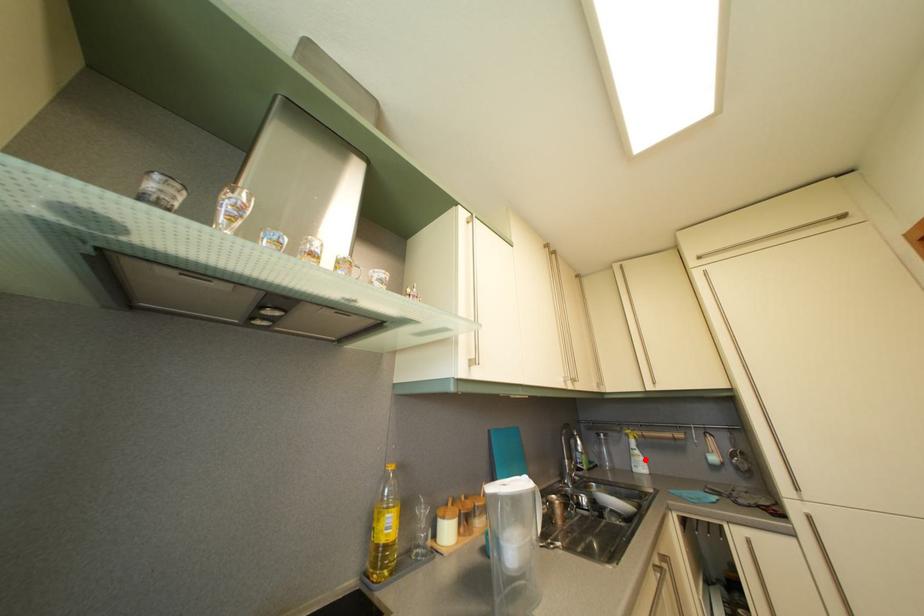
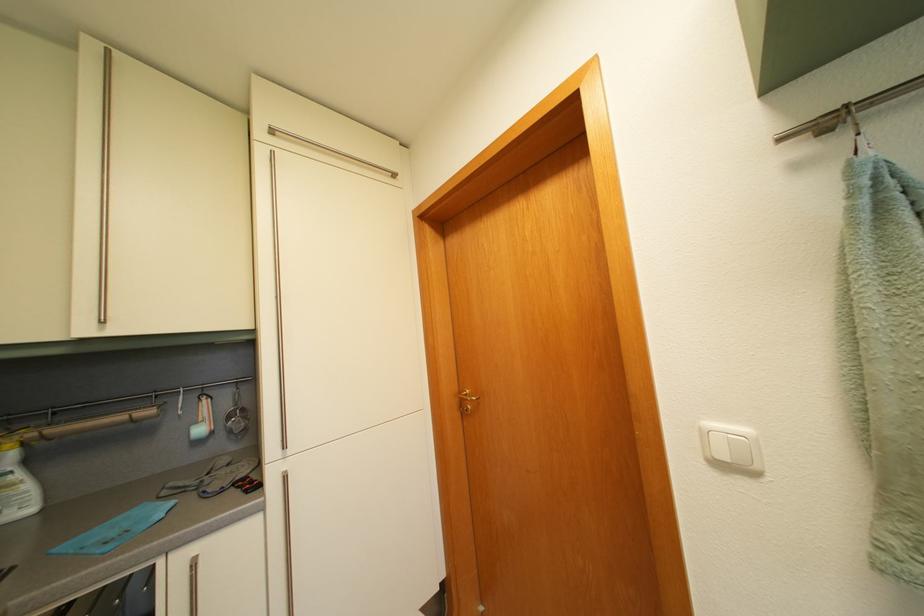
Question: I am providing you with two images of the same scene from different viewpoints. Image1 has a red point marked. In image2, the corresponding 3D location appears at what relative position? Reply with the corresponding letter.

Choices:
 (A) Closer
 (B) Farther

Answer: (A)